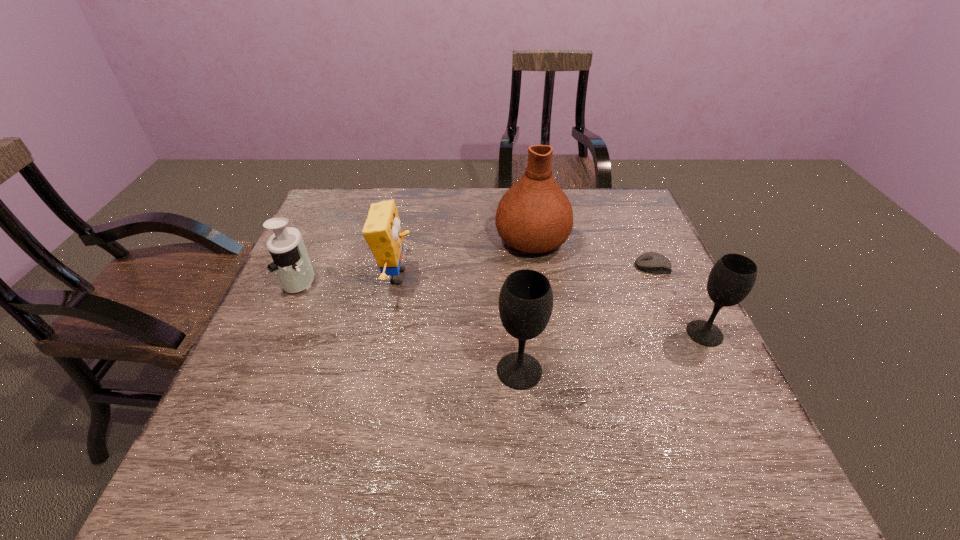
Locate an element on the screen. The image size is (960, 540). the left wineglass is located at coordinates (526, 299).

Find the location of a particular element. Image resolution: width=960 pixels, height=540 pixels. the nearest object is located at coordinates (526, 299).

Where is `the second nearest object`? The image size is (960, 540). the second nearest object is located at coordinates (733, 276).

Image resolution: width=960 pixels, height=540 pixels. In order to click on the right wineglass in this screenshot , I will do `click(733, 276)`.

Identify the location of pitcher. The image size is (960, 540). (534, 216).

Where is `juicer`? This screenshot has width=960, height=540. juicer is located at coordinates (291, 262).

At what (x,y) coordinates should I click in order to perform the action: click on sponge. Please return your answer as a coordinate pair (x, y). The height and width of the screenshot is (540, 960). Looking at the image, I should click on (382, 230).

Identify the location of computer equipment. (651, 262).

Locate an element on the screen. This screenshot has height=540, width=960. vacant space located on the back of the taller wineglass is located at coordinates (514, 302).

What are the coordinates of `free spot located on the back of the right wineglass` in the screenshot? It's located at click(661, 246).